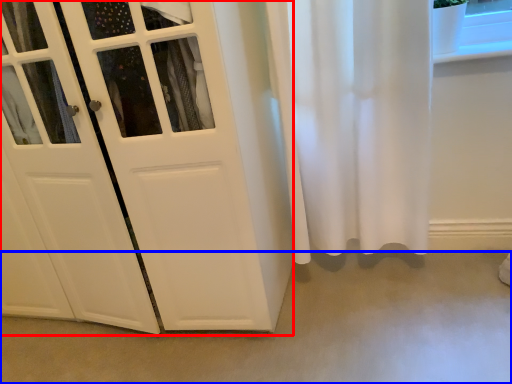
Question: Which of the following is the closest to the observer, door (highlighted by a red box) or concrete (highlighted by a blue box)?

Choices:
 (A) door
 (B) concrete

Answer: (A)